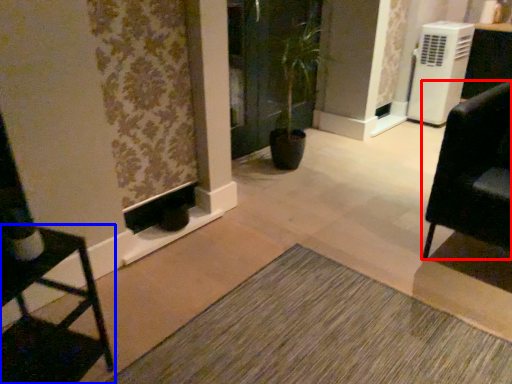
Question: Which of the following is the closest to the observer, furniture (highlighted by a red box) or furniture (highlighted by a blue box)?

Choices:
 (A) furniture
 (B) furniture

Answer: (B)